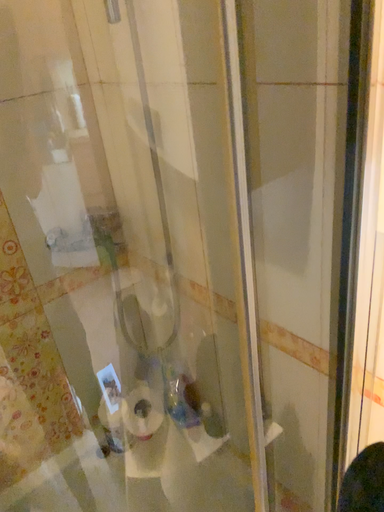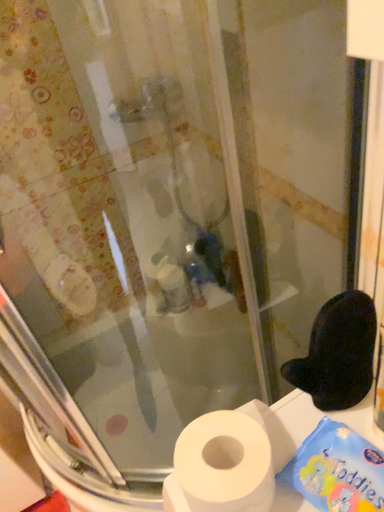
Question: How did the camera likely rotate when shooting the video?

Choices:
 (A) rotated downward
 (B) rotated upward

Answer: (A)